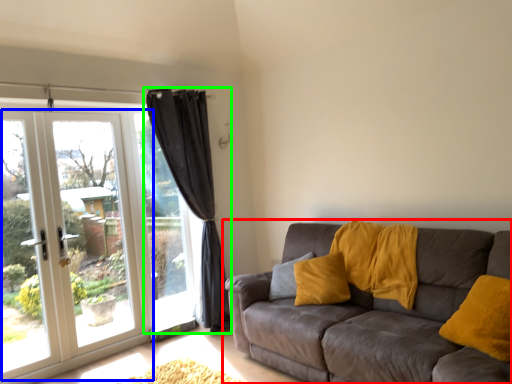
Question: Which object is positioned closest to studio couch (highlighted by a red box)? Select from door (highlighted by a blue box) and curtain (highlighted by a green box).

Choices:
 (A) door
 (B) curtain

Answer: (B)